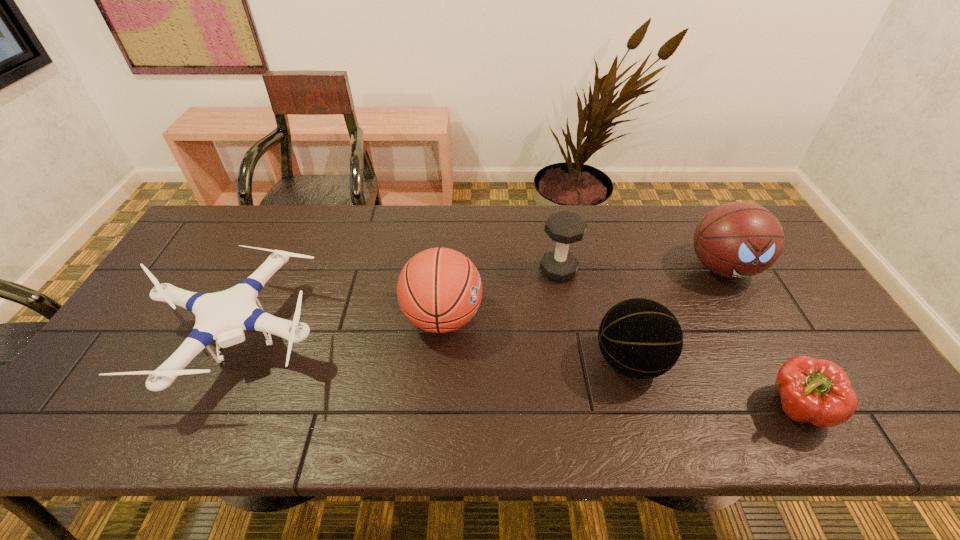
At what (x,y) coordinates should I click in order to perform the action: click on free space between the leftmost object and the dumbbell. Please return your answer as a coordinate pair (x, y). Image resolution: width=960 pixels, height=540 pixels. Looking at the image, I should click on (396, 306).

Where is `vacant region between the rightmost basketball and the dumbbell`? The image size is (960, 540). vacant region between the rightmost basketball and the dumbbell is located at coordinates [x=640, y=269].

The image size is (960, 540). In order to click on empty space between the leftmost basketball and the drone in this screenshot , I will do `click(338, 329)`.

Locate an element on the screen. The width and height of the screenshot is (960, 540). object that stands as the closest to the dumbbell is located at coordinates (439, 290).

What are the coordinates of `object that is the fourth closest to the leftmost object` in the screenshot? It's located at (738, 239).

Locate an element on the screen. The height and width of the screenshot is (540, 960). basketball that is the closest to the drone is located at coordinates (439, 290).

Choose which basketball is the second nearest neighbor to the leftmost basketball. Please provide its 2D coordinates. Your answer should be formatted as a tuple, i.e. [(x, y)], where the tuple contains the x and y coordinates of a point satisfying the conditions above.

[(738, 239)]

In order to click on free region that satisfies the following two spatial constraints: 1. on the back side of the pepper; 2. on the right side of the rightmost basketball in this screenshot , I will do `click(719, 268)`.

This screenshot has width=960, height=540. What are the coordinates of `free location that satisfies the following two spatial constraints: 1. on the logo side of the second object from left to right; 2. on the right side of the pepper` in the screenshot? It's located at (435, 409).